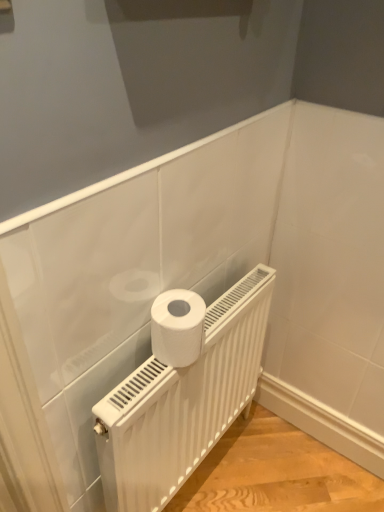
Question: Is white matte toilet paper at center in front of or behind white matte radiator at center in the image?

Choices:
 (A) front
 (B) behind

Answer: (B)

Question: Considering the positions of white matte toilet paper at center and white matte radiator at center in the image, is white matte toilet paper at center bigger or smaller than white matte radiator at center?

Choices:
 (A) big
 (B) small

Answer: (B)

Question: Visually, is white matte toilet paper at center positioned to the left or to the right of white matte radiator at center?

Choices:
 (A) right
 (B) left

Answer: (B)

Question: Looking at their shapes, would you say white matte radiator at center is wider or thinner than white matte toilet paper at center?

Choices:
 (A) thin
 (B) wide

Answer: (A)

Question: Based on their positions, is white matte radiator at center located to the left or right of white matte toilet paper at center?

Choices:
 (A) right
 (B) left

Answer: (A)

Question: Is white matte radiator at center in front of or behind white matte toilet paper at center in the image?

Choices:
 (A) behind
 (B) front

Answer: (B)

Question: In terms of height, does white matte radiator at center look taller or shorter compared to white matte toilet paper at center?

Choices:
 (A) short
 (B) tall

Answer: (B)